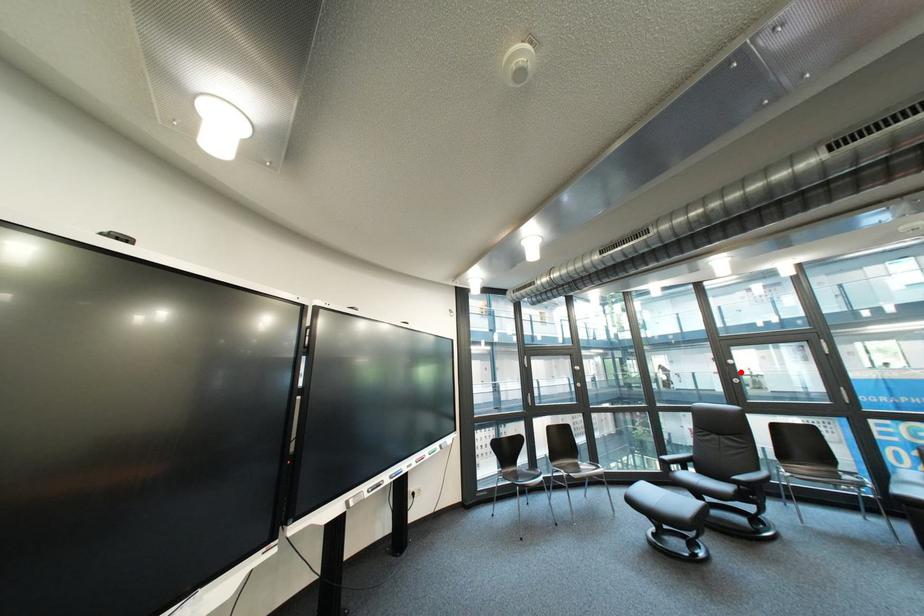
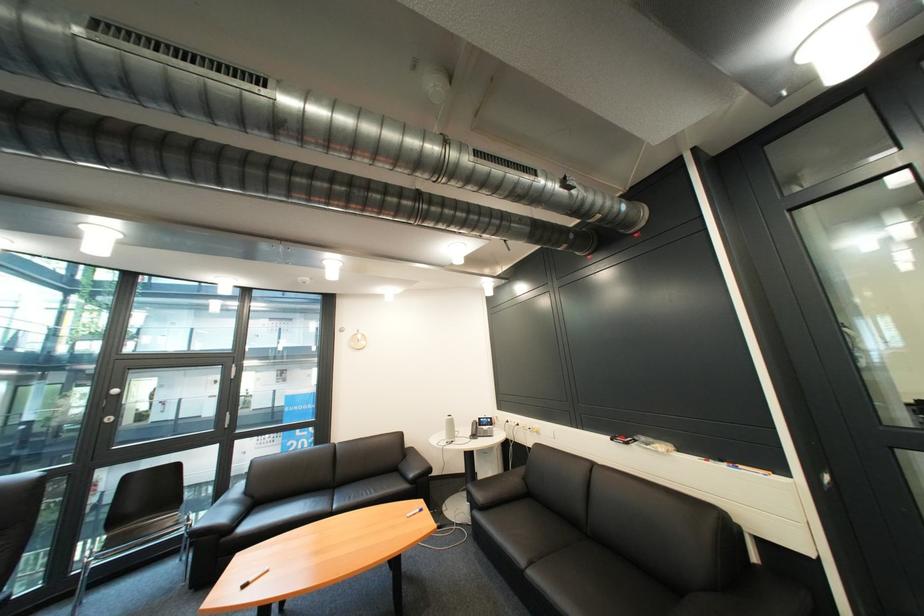
Question: I am providing you with two images of the same scene from different viewpoints. A red point is shown in image1. For the corresponding object point in image2, is it positioned nearer or farther from the camera?

Choices:
 (A) Nearer
 (B) Farther

Answer: (A)